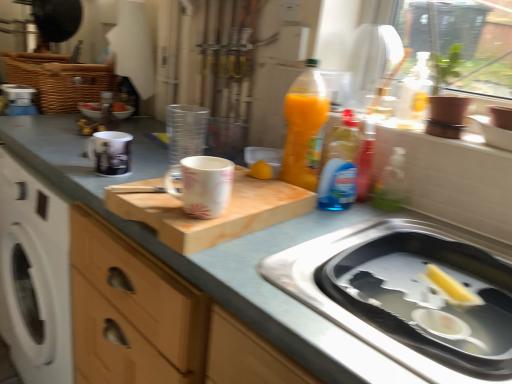
Question: Is metallic silver bottle at upper center, which ranks as the second bottle in front-to-back order, in front of wooden cutting board at center?

Choices:
 (A) no
 (B) yes

Answer: (A)

Question: Considering the relative positions of metallic silver bottle at upper center, positioned as the first bottle in left-to-right order, and wooden cutting board at center in the image provided, is metallic silver bottle at upper center, positioned as the first bottle in left-to-right order, to the right of wooden cutting board at center from the viewer's perspective?

Choices:
 (A) no
 (B) yes

Answer: (A)

Question: Is metallic silver bottle at upper center, the second bottle positioned from the bottom, shorter than wooden cutting board at center?

Choices:
 (A) yes
 (B) no

Answer: (B)

Question: Considering the relative sizes of metallic silver bottle at upper center, which ranks as the second bottle in front-to-back order, and wooden cutting board at center in the image provided, is metallic silver bottle at upper center, which ranks as the second bottle in front-to-back order, wider than wooden cutting board at center?

Choices:
 (A) yes
 (B) no

Answer: (B)

Question: Is there a large distance between metallic silver bottle at upper center, marked as the 1th bottle in a top-to-bottom arrangement, and wooden cutting board at center?

Choices:
 (A) no
 (B) yes

Answer: (A)

Question: From the image's perspective, is translucent plastic bottle at upper center, which is the second bottle from top to bottom, positioned above or below yellow rubber duck at sink right?

Choices:
 (A) above
 (B) below

Answer: (A)

Question: Is translucent plastic bottle at upper center, the 2th bottle in the left-to-right sequence, wider or thinner than yellow rubber duck at sink right?

Choices:
 (A) wide
 (B) thin

Answer: (A)

Question: In terms of height, does translucent plastic bottle at upper center, marked as the 2th bottle in a back-to-front arrangement, look taller or shorter compared to yellow rubber duck at sink right?

Choices:
 (A) short
 (B) tall

Answer: (B)

Question: From a real-world perspective, is translucent plastic bottle at upper center, the 2th bottle in the left-to-right sequence, physically located above or below yellow rubber duck at sink right?

Choices:
 (A) below
 (B) above

Answer: (B)

Question: In terms of width, does metallic silver bottle at upper center, the second bottle positioned from the bottom, look wider or thinner when compared to translucent plastic bottle at upper center, marked as the 2th bottle in a back-to-front arrangement?

Choices:
 (A) wide
 (B) thin

Answer: (B)

Question: Is metallic silver bottle at upper center, the second bottle positioned from the bottom, bigger or smaller than translucent plastic bottle at upper center, marked as the 2th bottle in a back-to-front arrangement?

Choices:
 (A) big
 (B) small

Answer: (B)

Question: From a real-world perspective, is metallic silver bottle at upper center, the 2th bottle from the right, above or below translucent plastic bottle at upper center, the 1th bottle viewed from the front?

Choices:
 (A) below
 (B) above

Answer: (A)

Question: Does point (115, 119) appear closer or farther from the camera than point (342, 152)?

Choices:
 (A) farther
 (B) closer

Answer: (A)

Question: From a real-world perspective, is matte white mug at upper left, the second mug positioned from the right, physically located above or below translucent plastic bottle at upper center, the 1th bottle viewed from the front?

Choices:
 (A) above
 (B) below

Answer: (B)

Question: Considering the positions of matte white mug at upper left, which is the 2th mug from front to back, and translucent plastic bottle at upper center, the 2th bottle in the left-to-right sequence, in the image, is matte white mug at upper left, which is the 2th mug from front to back, bigger or smaller than translucent plastic bottle at upper center, the 2th bottle in the left-to-right sequence,?

Choices:
 (A) big
 (B) small

Answer: (A)